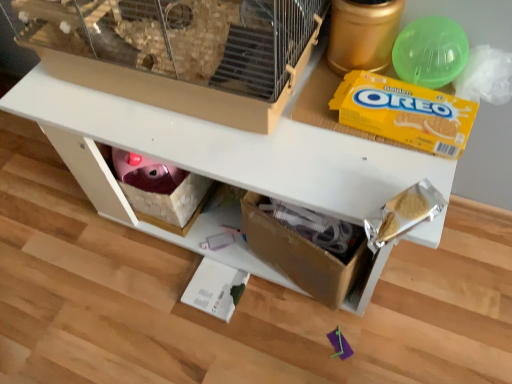
Where is `vacant space to the left of yellow cardboard oreo at upper right`? This screenshot has width=512, height=384. vacant space to the left of yellow cardboard oreo at upper right is located at coordinates (308, 139).